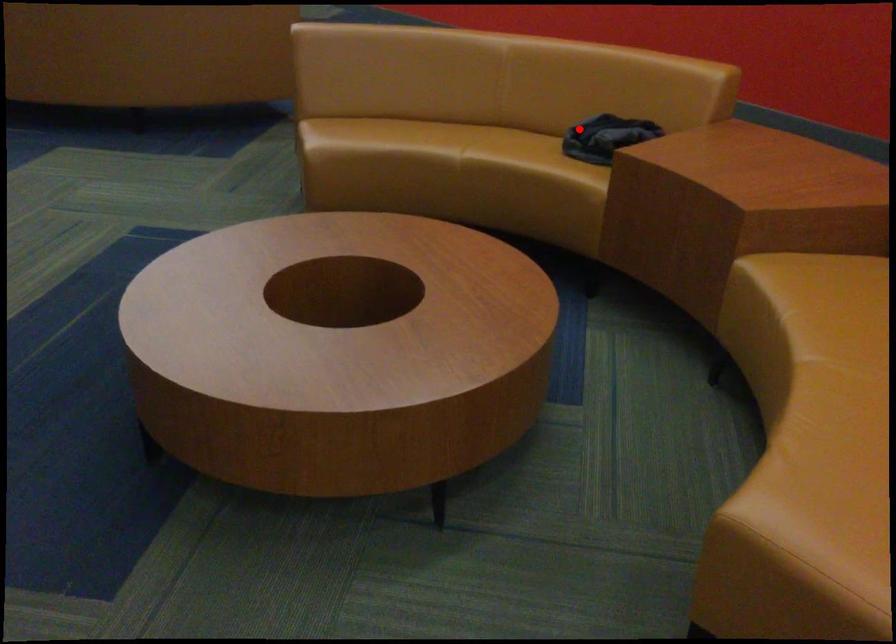
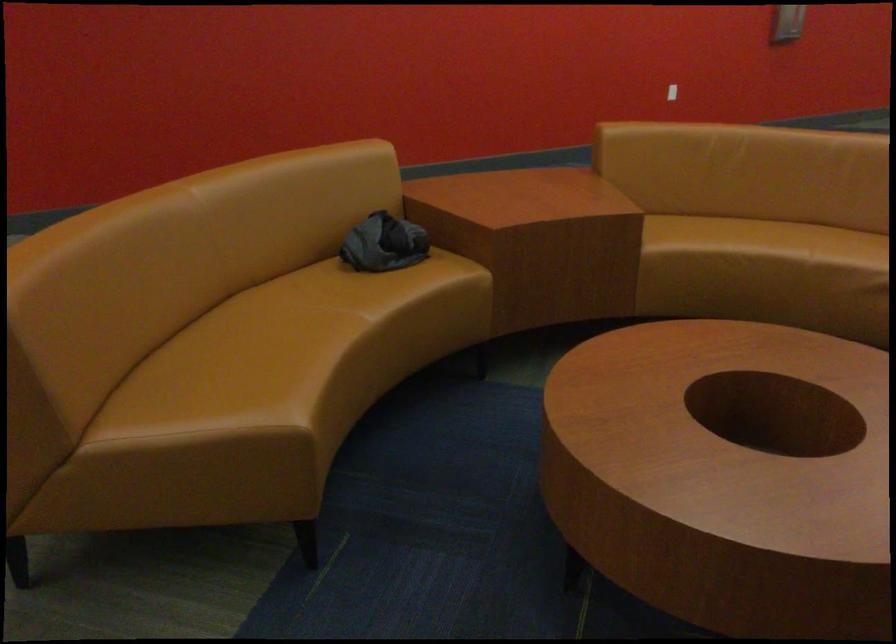
Question: I am providing you with two images of the same scene from different viewpoints. In image1, a red point is highlighted. Considering the same 3D point in image2, which of the following is correct?

Choices:
 (A) It is closer
 (B) It is farther

Answer: (A)